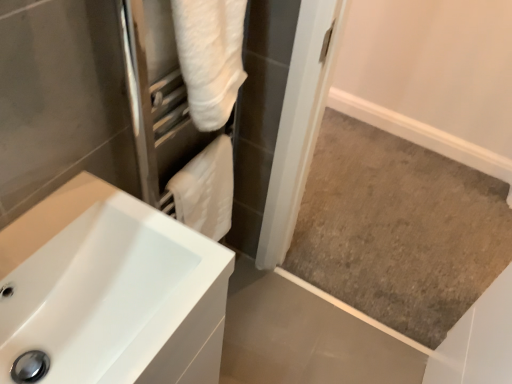
Question: From the image's perspective, would you say white fluffy towel at upper center is positioned over white glossy sink at lower left?

Choices:
 (A) no
 (B) yes

Answer: (B)

Question: Is white glossy sink at lower left at the back of white fluffy towel at upper center?

Choices:
 (A) no
 (B) yes

Answer: (A)

Question: Is there a large distance between white fluffy towel at upper center and white glossy sink at lower left?

Choices:
 (A) yes
 (B) no

Answer: (B)

Question: From a real-world perspective, is white fluffy towel at upper center located higher than white glossy sink at lower left?

Choices:
 (A) yes
 (B) no

Answer: (A)

Question: Does white fluffy towel at upper center come behind white glossy sink at lower left?

Choices:
 (A) no
 (B) yes

Answer: (B)

Question: Is white fluffy towel at upper center positioned before white glossy sink at lower left?

Choices:
 (A) no
 (B) yes

Answer: (A)

Question: Does white glossy sink at lower left appear on the left side of white soft towel at center?

Choices:
 (A) no
 (B) yes

Answer: (B)

Question: Does white glossy sink at lower left have a lesser width compared to white soft towel at center?

Choices:
 (A) yes
 (B) no

Answer: (B)

Question: Is white glossy sink at lower left outside of white soft towel at center?

Choices:
 (A) yes
 (B) no

Answer: (A)

Question: Are white glossy sink at lower left and white soft towel at center located far from each other?

Choices:
 (A) yes
 (B) no

Answer: (B)

Question: From a real-world perspective, is white glossy sink at lower left below white soft towel at center?

Choices:
 (A) no
 (B) yes

Answer: (B)

Question: Does white glossy sink at lower left turn towards white soft towel at center?

Choices:
 (A) yes
 (B) no

Answer: (B)

Question: Is white glossy sink at lower left smaller than white fluffy towel at upper center?

Choices:
 (A) no
 (B) yes

Answer: (A)